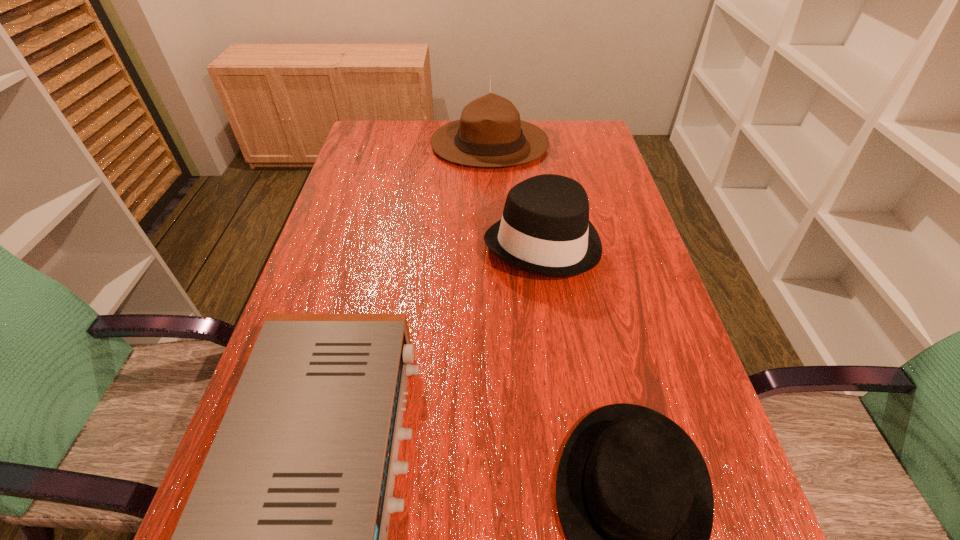
The image size is (960, 540). Identify the location of the farthest fedora. (489, 133).

Identify the location of the second farthest object. This screenshot has height=540, width=960. (545, 230).

Locate an element on the screen. The width and height of the screenshot is (960, 540). free space located 0.190m on the feather side of the farthest fedora is located at coordinates (372, 144).

Find the location of a particular element. The width and height of the screenshot is (960, 540). free space located on the feather side of the farthest fedora is located at coordinates (406, 144).

Locate an element on the screen. blank area located on the feather side of the farthest fedora is located at coordinates (391, 144).

Locate an element on the screen. vacant area located 0.190m on the left of the second farthest fedora is located at coordinates (405, 242).

Locate an element on the screen. The image size is (960, 540). object that is positioned at the far edge is located at coordinates [x=489, y=133].

Locate an element on the screen. This screenshot has width=960, height=540. object that is at the right edge is located at coordinates (545, 230).

The image size is (960, 540). I want to click on vacant space at the left edge of the desktop, so click(361, 181).

The height and width of the screenshot is (540, 960). Find the location of `free space at the right edge`. free space at the right edge is located at coordinates (609, 197).